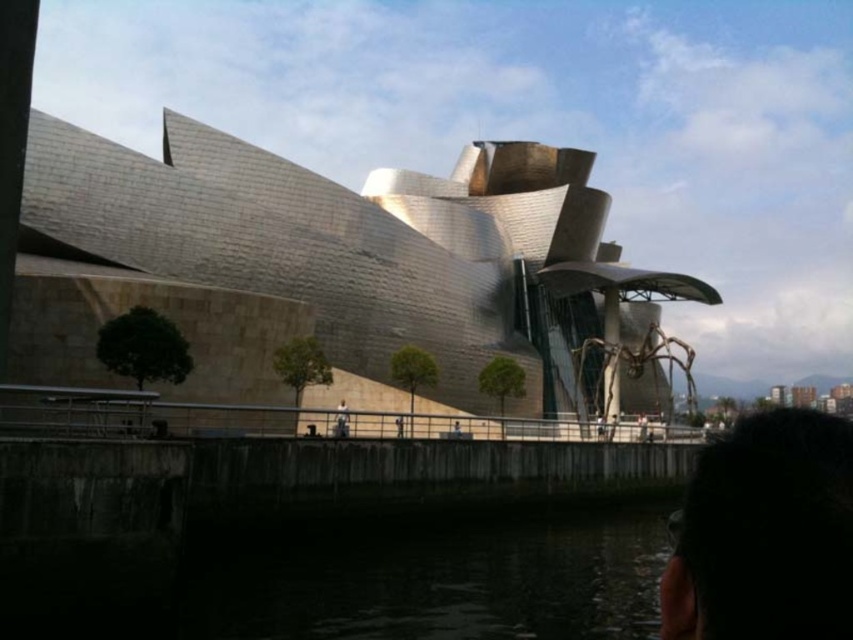
Question: Does dark water at lower center have a lesser width compared to dark hair at center?

Choices:
 (A) no
 (B) yes

Answer: (A)

Question: Which object is the closest to the dark hair at center?

Choices:
 (A) metallic silver building at center
 (B) dark water at lower center

Answer: (B)

Question: Does metallic silver building at center appear on the right side of dark hair at center?

Choices:
 (A) no
 (B) yes

Answer: (B)

Question: Does dark hair at lower right have a smaller size compared to dark hair at center?

Choices:
 (A) no
 (B) yes

Answer: (A)

Question: Which is nearer to the metallic silver building at center?

Choices:
 (A) dark hair at center
 (B) dark hair at lower right
 (C) dark water at lower center

Answer: (C)

Question: Among these points, which one is nearest to the camera?

Choices:
 (A) (544, 188)
 (B) (341, 410)
 (C) (844, 563)

Answer: (C)